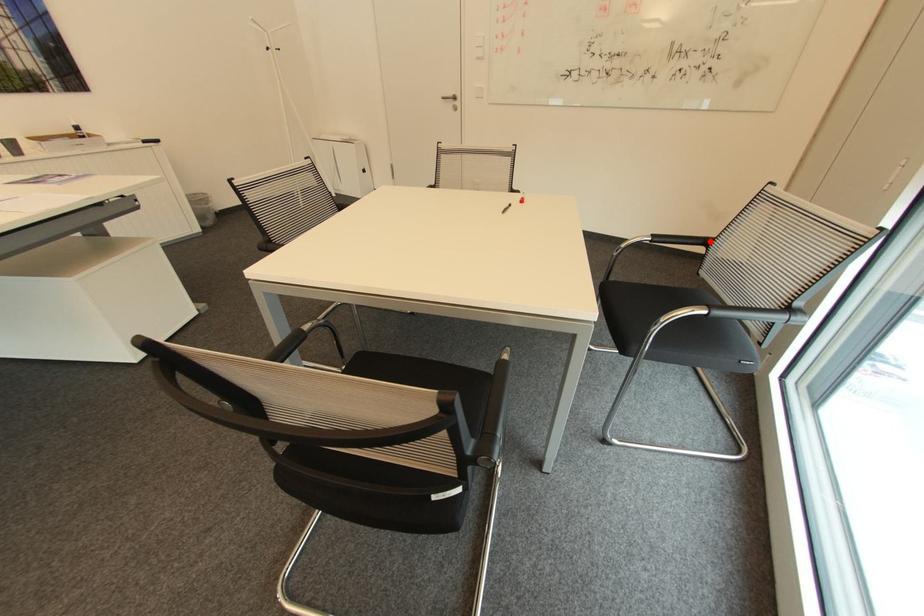
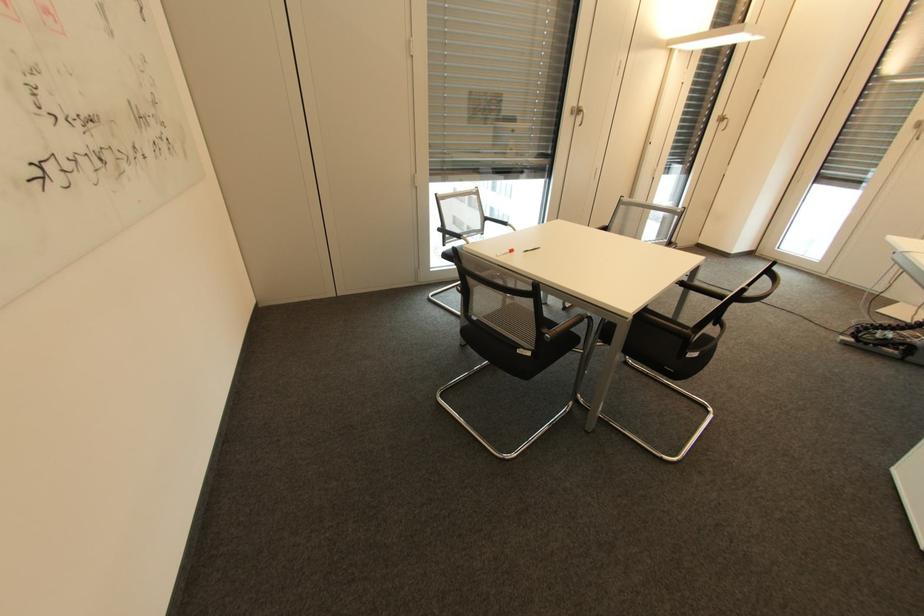
Question: I am providing you with two images of the same scene from different viewpoints. In image1, a red point is highlighted. Considering the same 3D point in image2, which of the following is correct?

Choices:
 (A) It is closer
 (B) It is farther

Answer: (A)